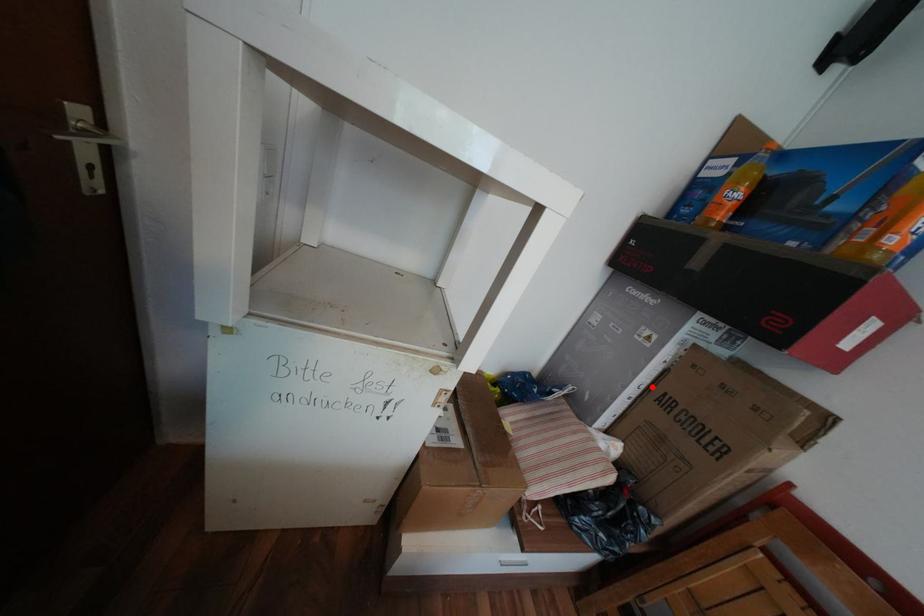
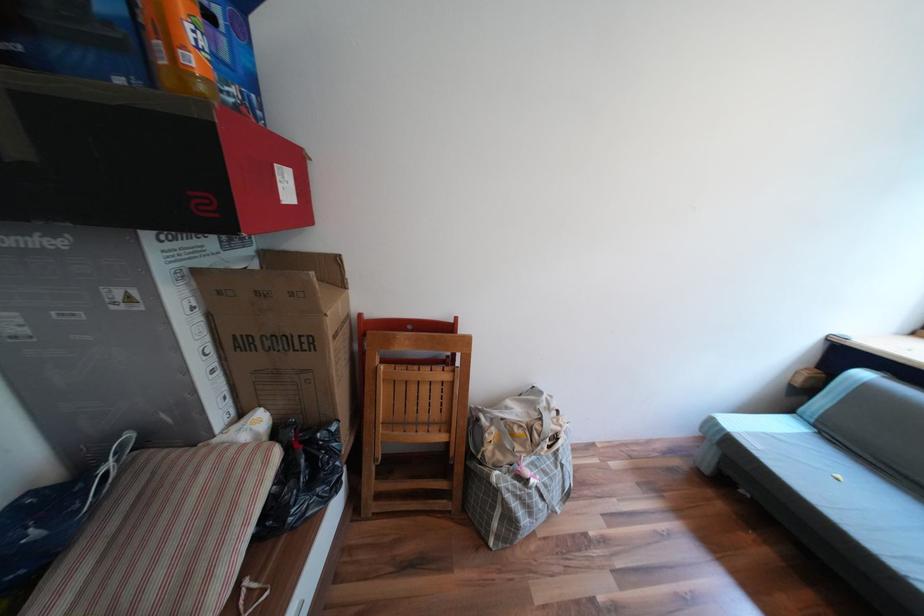
Where in the second image is the point corresponding to the highlighted location from the first image?

(219, 349)